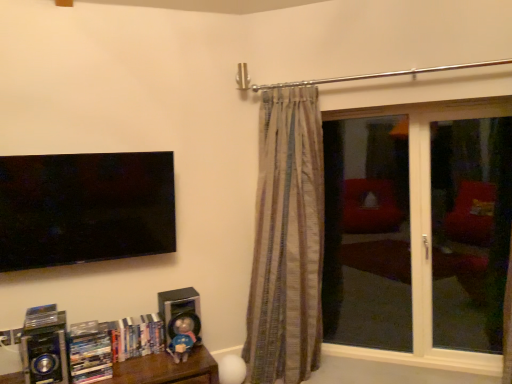
Question: Considering the positions of transparent glass window at right and silver metallic speaker at lower center, which is the 2th speaker from front to back, in the image, is transparent glass window at right bigger or smaller than silver metallic speaker at lower center, which is the 2th speaker from front to back,?

Choices:
 (A) small
 (B) big

Answer: (B)

Question: In terms of height, does transparent glass window at right look taller or shorter compared to silver metallic speaker at lower center, which is the 1th speaker in back-to-front order?

Choices:
 (A) short
 (B) tall

Answer: (B)

Question: Which object is positioned closest to the metallic blue speaker at lower left, arranged as the 2th speaker when viewed from the back?

Choices:
 (A) transparent glass screen door at right, acting as the 2th screen door starting from the left
 (B) metallic silver stereo at lower left
 (C) matte plastic books at lower left
 (D) matte blue plush at lower center
 (E) striped fabric curtain at center

Answer: (C)

Question: Considering the real-world distances, which object is closest to the transparent glass screen door at right, the 1th screen door when ordered from left to right?

Choices:
 (A) transparent glass window at right
 (B) matte plastic books at lower left
 (C) metallic blue speaker at lower left, arranged as the 2th speaker when viewed from the back
 (D) transparent glass screen door at right, acting as the 2th screen door starting from the left
 (E) metallic silver stereo at lower left

Answer: (D)